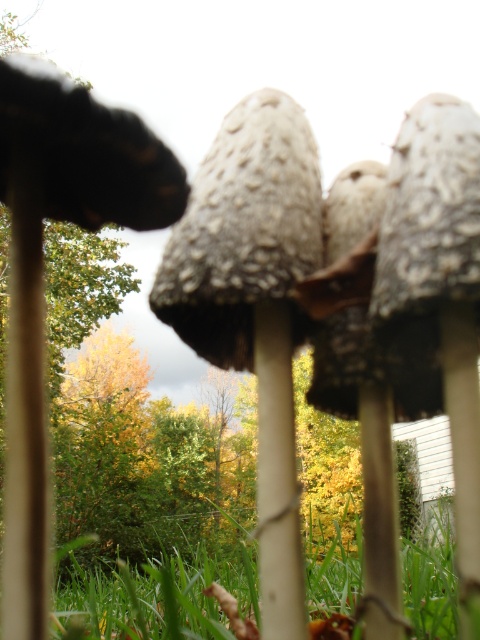
You are a gardener looking at the mushrooms in the image. You notice the green grass at lower center and the brown matte stem at left. Which object is located lower in the image?

The green grass at lower center is positioned under brown matte stem at left, so the green grass at lower center is lower in the image.

You are a gardener who wants to place a small decoration between the green grass at lower center and the brown matte stem at left. Based on their positions, where should you place it?

Since the green grass at lower center is to the right of the brown matte stem at left, you should place the decoration between them by positioning it to the right of the brown matte stem at left and to the left of the green grass at lower center.